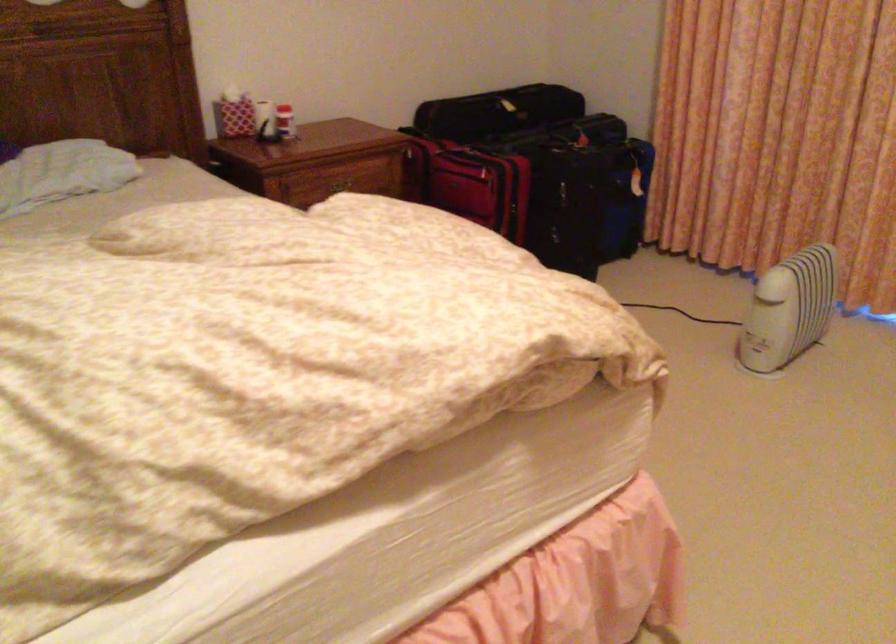
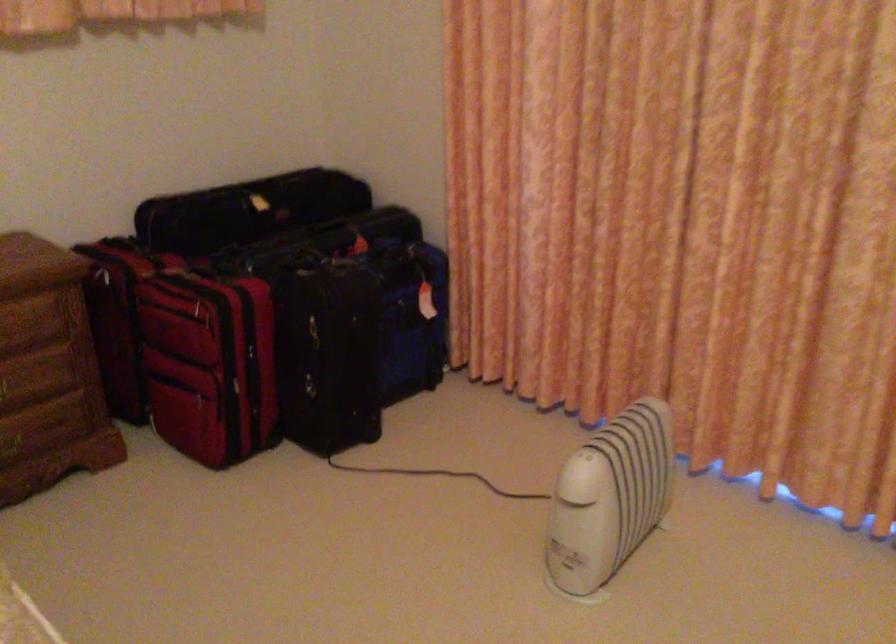
In the second image, find the point that corresponds to (480,169) in the first image.

(202, 305)